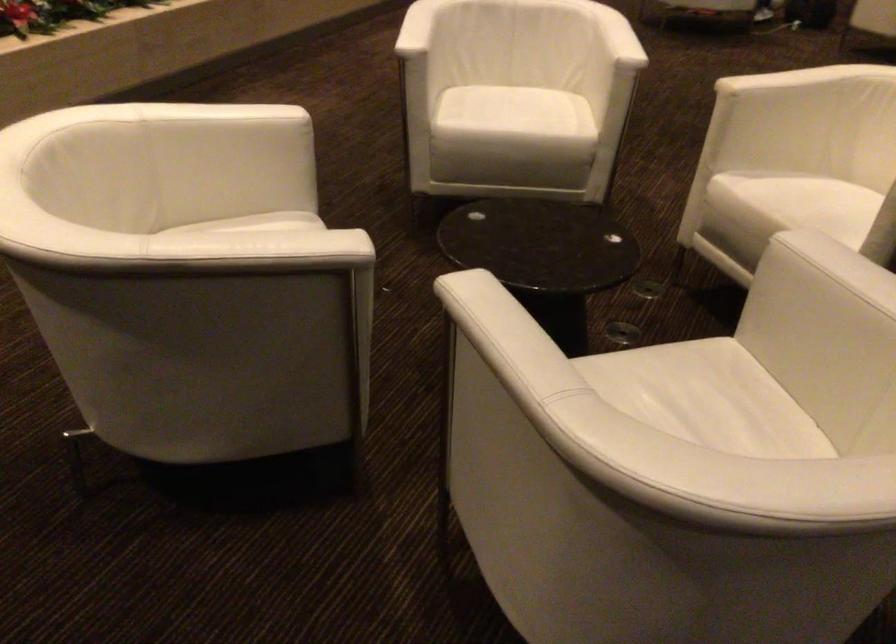
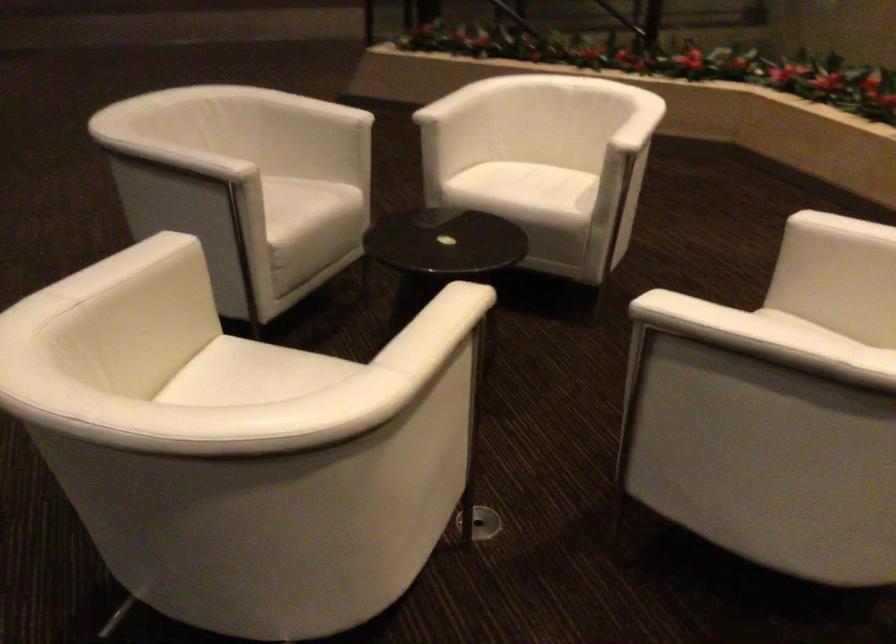
Find the pixel in the second image that matches point 142,236 in the first image.

(469, 89)